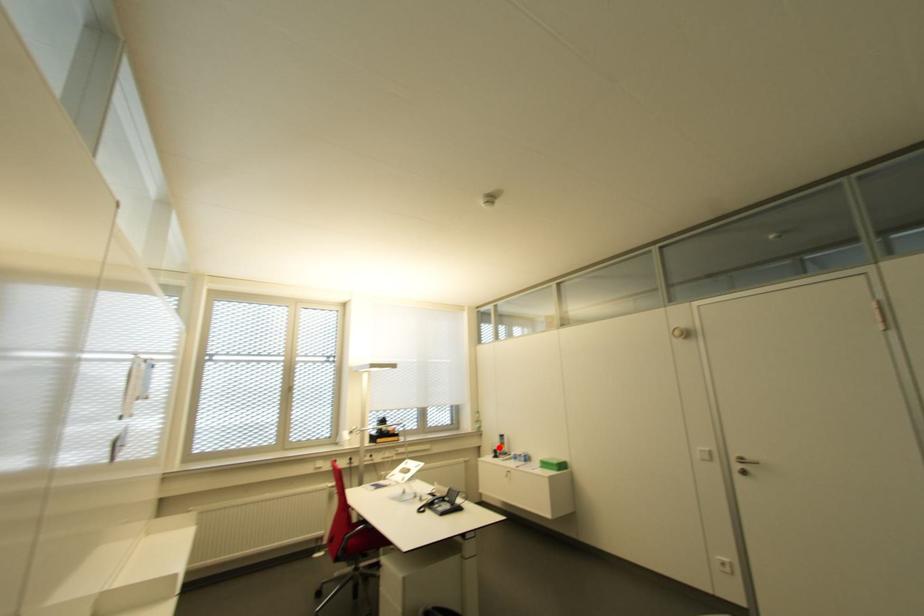
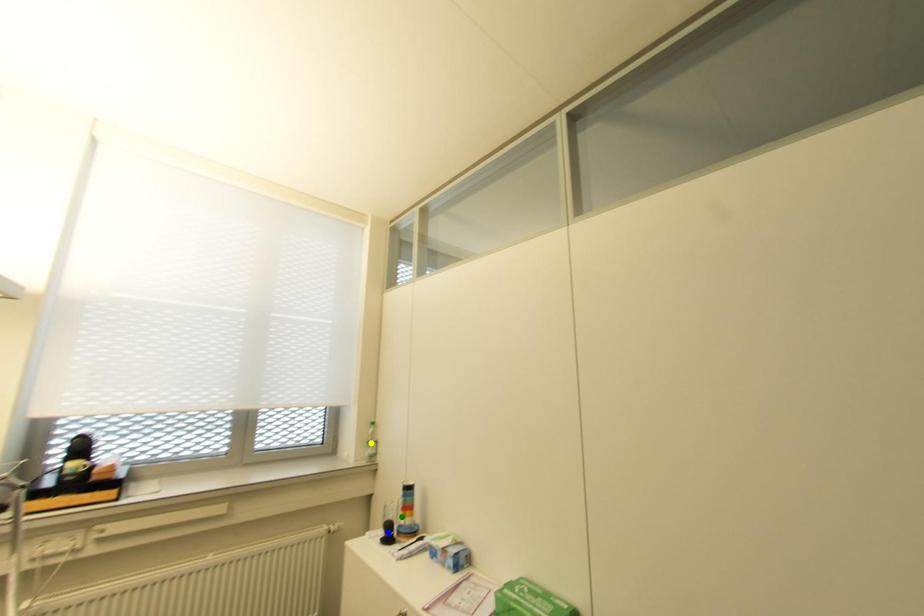
Question: I am providing you with two images of the same scene from different viewpoints. A red point is marked on the first image. You are given multiple points on the second image. Which spot in image 2 lines up with the point in image 1?

Choices:
 (A) green point
 (B) yellow point
 (C) blue point

Answer: (A)